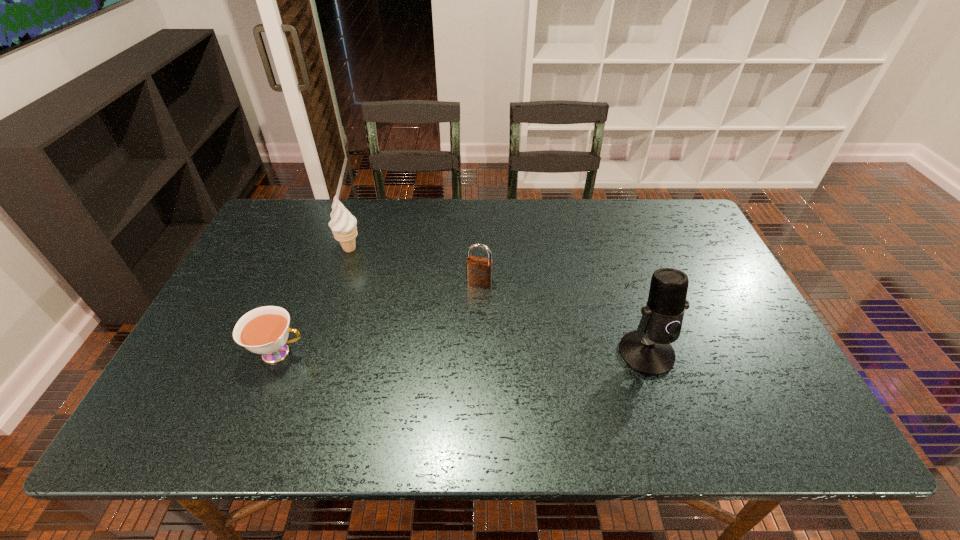
Identify the location of vacant area between the third nearest object and the icecream. (415, 265).

At what (x,y) coordinates should I click in order to perform the action: click on empty space between the shortest object and the second farthest object. Please return your answer as a coordinate pair (x, y). The image size is (960, 540). Looking at the image, I should click on (379, 318).

The image size is (960, 540). Find the location of `vacant point located between the third tallest object and the rightmost object`. vacant point located between the third tallest object and the rightmost object is located at coordinates (563, 318).

Find the location of a particular element. The height and width of the screenshot is (540, 960). free space between the shortest object and the second object from right to left is located at coordinates (379, 318).

Identify which object is the second closest to the teacup. Please provide its 2D coordinates. Your answer should be formatted as a tuple, i.e. [(x, y)], where the tuple contains the x and y coordinates of a point satisfying the conditions above.

[(479, 270)]

Identify which object is the second nearest to the second tallest object. Please provide its 2D coordinates. Your answer should be formatted as a tuple, i.e. [(x, y)], where the tuple contains the x and y coordinates of a point satisfying the conditions above.

[(479, 270)]

At what (x,y) coordinates should I click in order to perform the action: click on free space that satisfies the following two spatial constraints: 1. on the front side of the icecream; 2. on the right side of the third nearest object. Please return your answer as a coordinate pair (x, y). This screenshot has width=960, height=540. Looking at the image, I should click on (338, 282).

At what (x,y) coordinates should I click in order to perform the action: click on vacant space that satisfies the following two spatial constraints: 1. on the front side of the farthest object; 2. on the left side of the third tallest object. Please return your answer as a coordinate pair (x, y). Looking at the image, I should click on (338, 282).